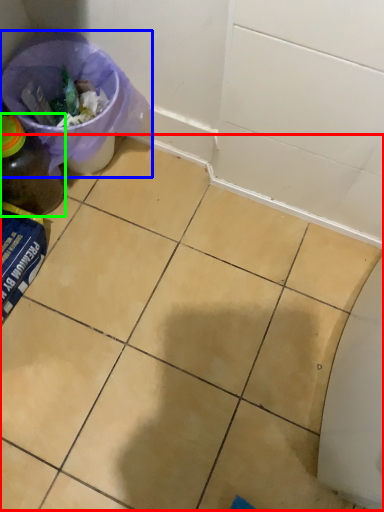
Question: Considering the real-world distances, which object is closest to ceramic tile (highlighted by a red box)? recycling bin (highlighted by a blue box) or bottle (highlighted by a green box).

Choices:
 (A) recycling bin
 (B) bottle

Answer: (A)